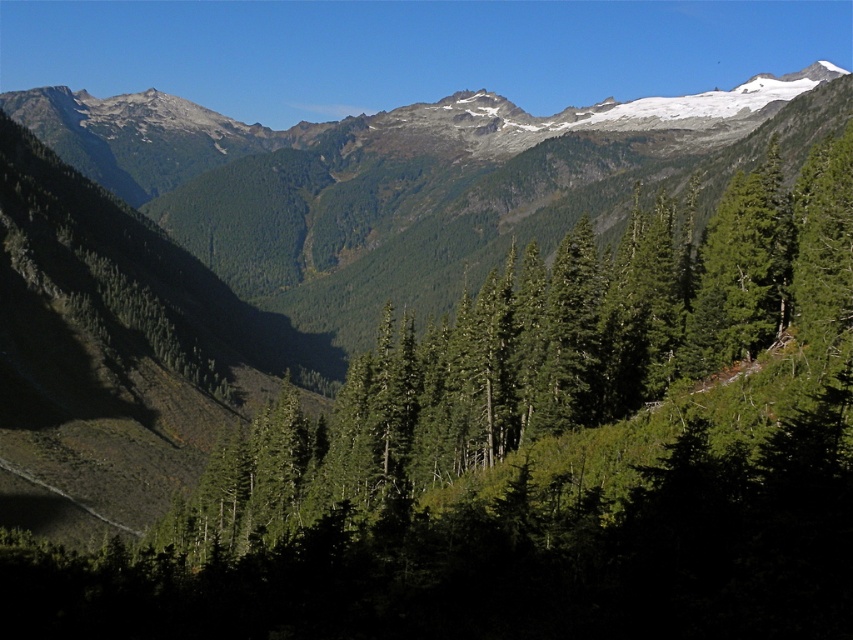
Is point (546, 348) less distant than point (132, 109)?

Yes, point (546, 348) is closer to viewer.

Which is in front, point (804, 323) or point (238, 268)?

Point (804, 323) is in front.

At what (x,y) coordinates should I click in order to perform the action: click on green textured tree at center. Please return your answer as a coordinate pair (x, y). Looking at the image, I should click on (543, 355).